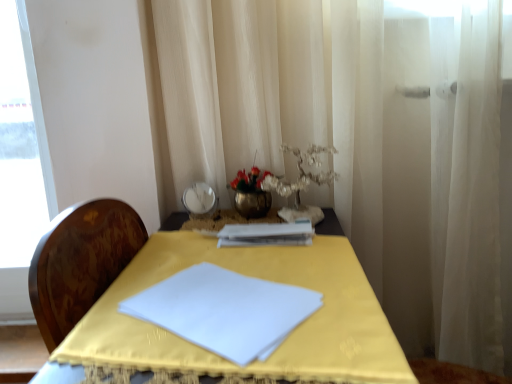
This screenshot has width=512, height=384. In order to click on vacant region to the left of white paper journal at center in this screenshot , I will do `click(188, 246)`.